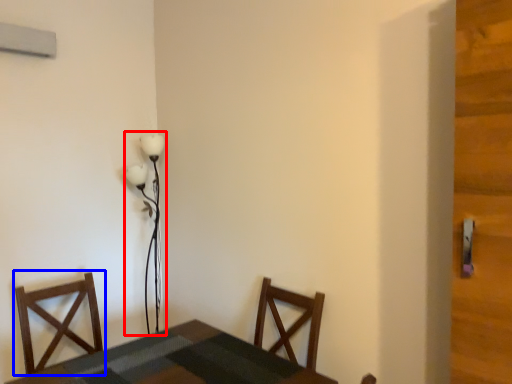
Question: Which object is further to the camera taking this photo, lamp (highlighted by a red box) or chair (highlighted by a blue box)?

Choices:
 (A) lamp
 (B) chair

Answer: (A)